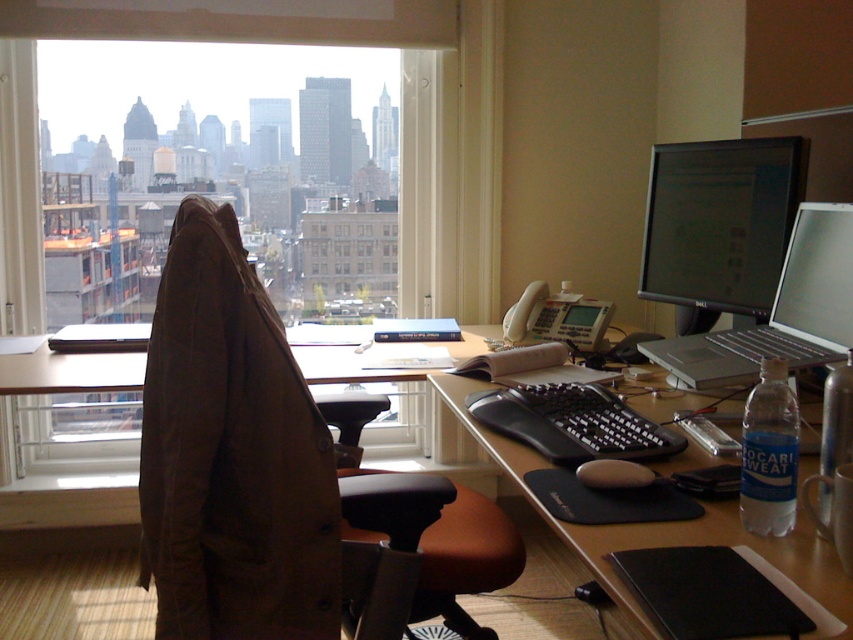
Question: Estimate the real-world distances between objects in this image. Which object is farther from the black rubberized keyboard at center?

Choices:
 (A) brown fabric swivel chair at center
 (B) transparent glass window at upper center
 (C) black plastic keyboard at center
 (D) silver metallic laptop at upper right

Answer: (B)

Question: Which object is the closest to the brown fabric swivel chair at center?

Choices:
 (A) black plastic keyboard at center
 (B) transparent glass window at upper center
 (C) silver metallic laptop at upper right

Answer: (A)

Question: Is brown fabric swivel chair at center below transparent glass window at upper center?

Choices:
 (A) no
 (B) yes

Answer: (B)

Question: Is the position of silver metallic laptop at upper right less distant than that of black rubberized keyboard at center?

Choices:
 (A) yes
 (B) no

Answer: (B)

Question: Observing the image, what is the correct spatial positioning of transparent glass window at upper center in reference to black glossy monitor at upper right?

Choices:
 (A) above
 (B) below

Answer: (A)

Question: Estimate the real-world distances between objects in this image. Which object is closer to the transparent glass window at upper center?

Choices:
 (A) black rubberized keyboard at center
 (B) black glossy monitor at upper right

Answer: (B)